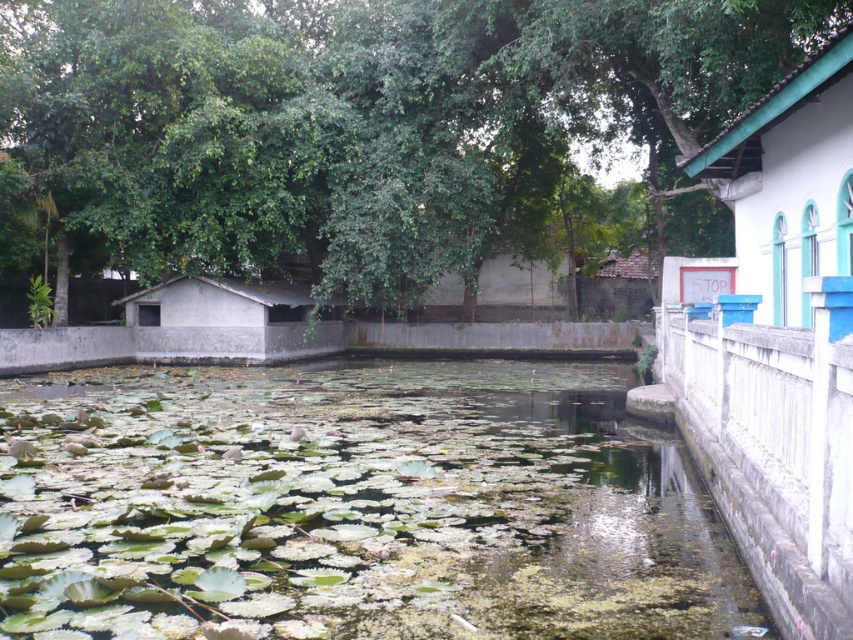
Based on the photo, you are planning to build a new shed in this area and need to know which existing structure is bigger. Based on the scene, which one is larger between the white painted wood hut at upper right and the brown clay hut at center?

The white painted wood hut at upper right is larger in size compared to the brown clay hut at center.

You are planning to build a new shed in this area and need to know which structure is bigger. Which is larger between the white painted wood hut at upper right and the gray concrete hut at center?

The white painted wood hut at upper right is larger in size than the gray concrete hut at center according to the description.